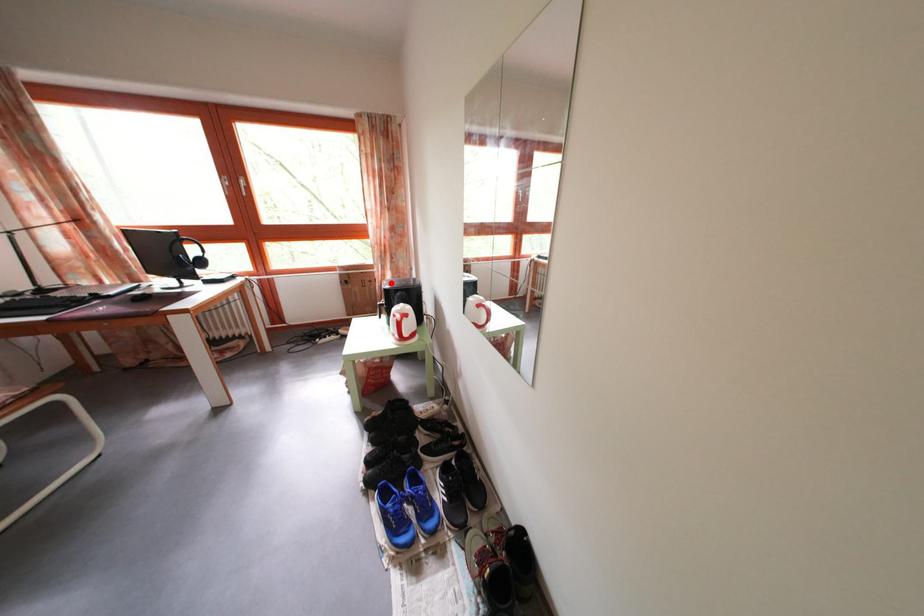
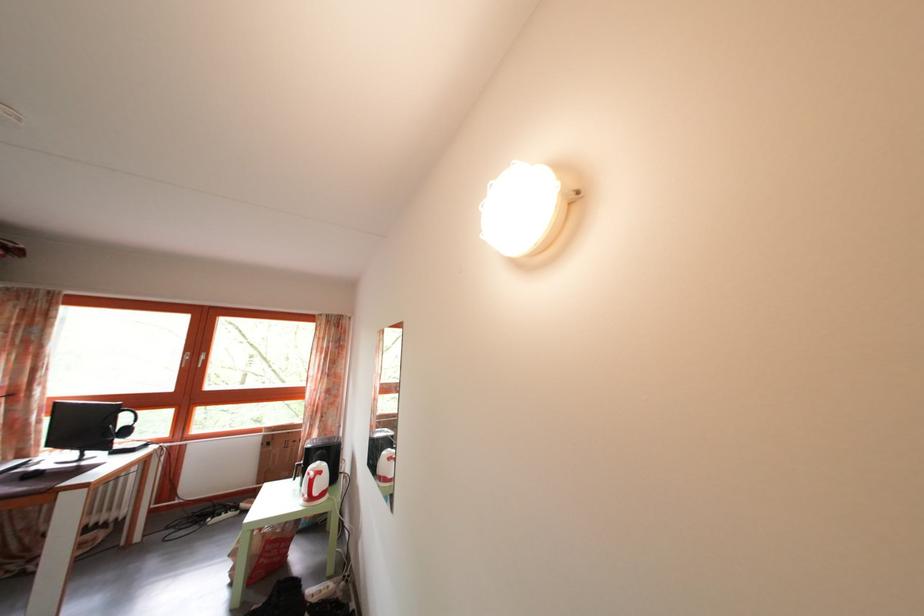
Locate, in the second image, the point that corresponds to the highlighted location in the first image.

(317, 442)